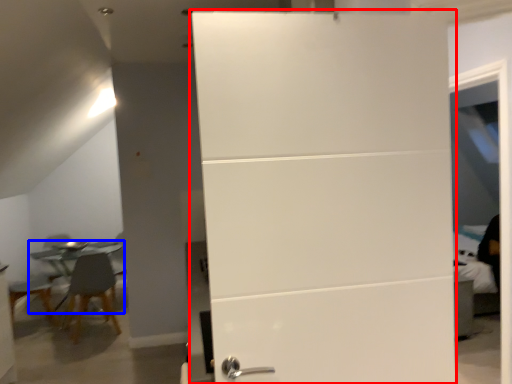
Question: Which object is closer to the camera taking this photo, door (highlighted by a red box) or table (highlighted by a blue box)?

Choices:
 (A) door
 (B) table

Answer: (A)